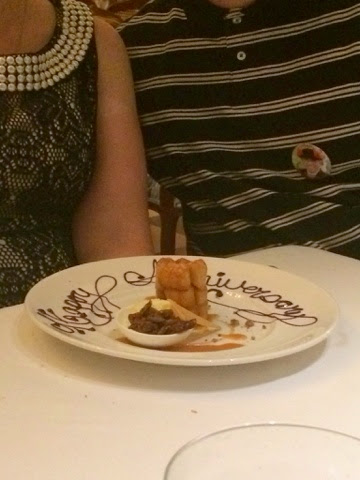
The image size is (360, 480). I want to click on glass, so click(264, 458).